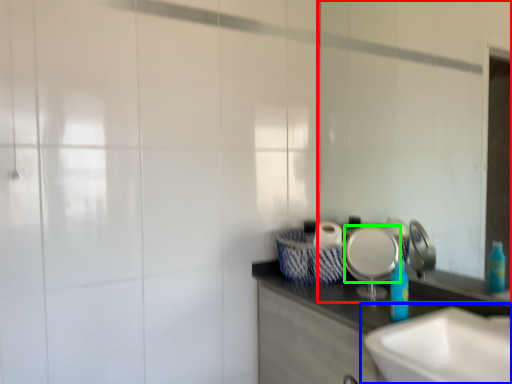
Question: Estimate the real-world distances between objects in this image. Which object is closer to mirror (highlighted by a red box), sink (highlighted by a blue box) or plate (highlighted by a green box)?

Choices:
 (A) sink
 (B) plate

Answer: (B)